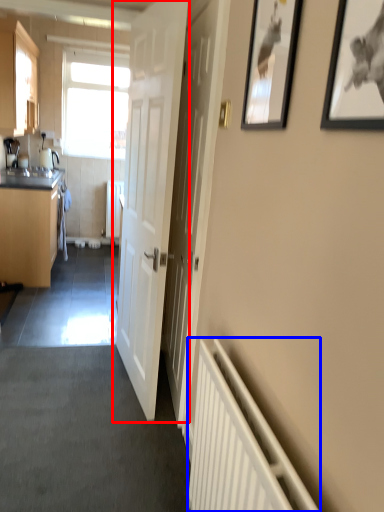
Question: Which point is closer to the camera, door (highlighted by a red box) or radiator (highlighted by a blue box)?

Choices:
 (A) door
 (B) radiator

Answer: (B)